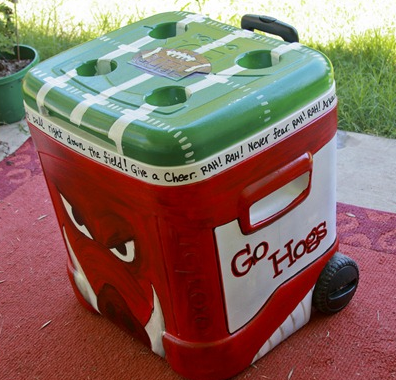
What are the coordinates of `rug` in the screenshot? It's located at (352, 359).